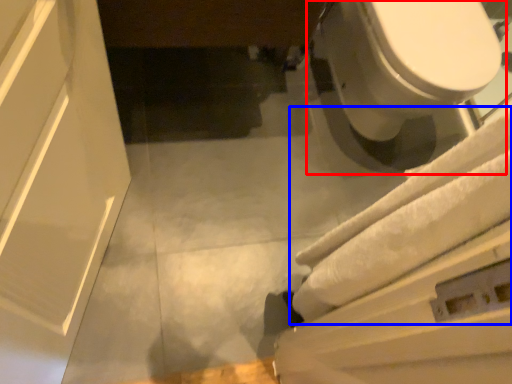
Question: Among these objects, which one is nearest to the camera, toilet (highlighted by a red box) or bath towel (highlighted by a blue box)?

Choices:
 (A) toilet
 (B) bath towel

Answer: (B)